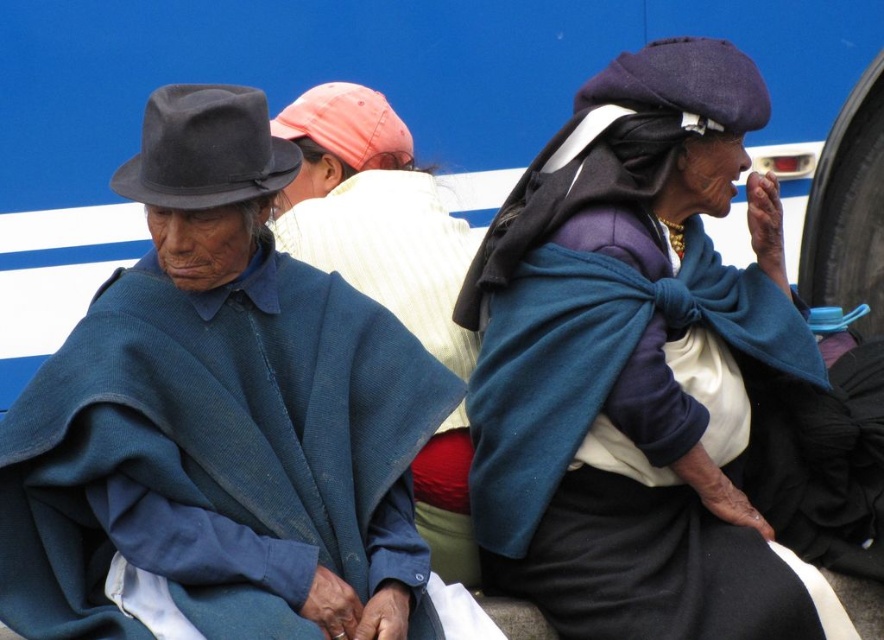
You are a fashion designer observing the matte blue poncho at left and the blue woolen poncho at center. Which poncho has a narrower width?

The matte blue poncho at left has a lesser width compared to the blue woolen poncho at center, so the matte blue poncho at left is narrower.